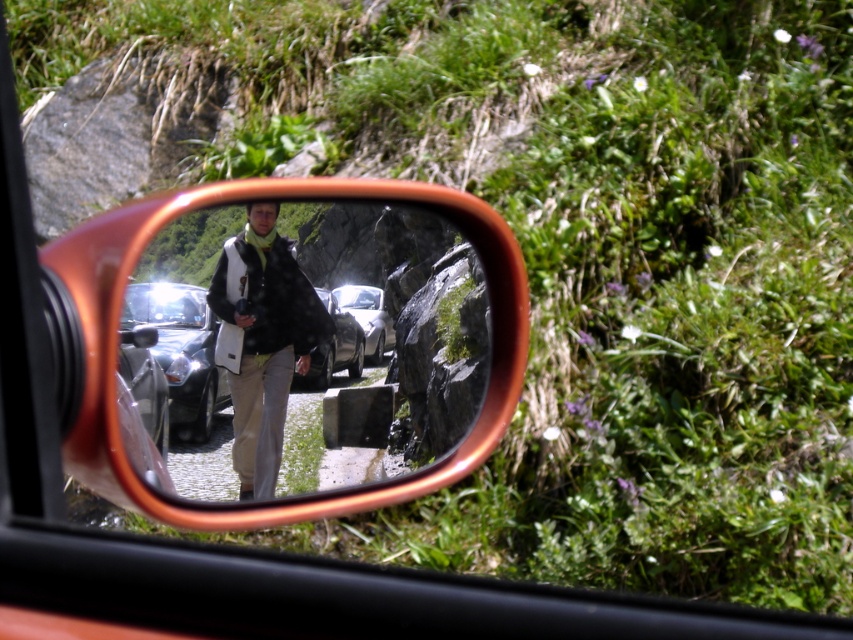
Can you confirm if matte black jacket at center is positioned to the left of shiny silver car at center?

No, matte black jacket at center is not to the left of shiny silver car at center.

Can you confirm if matte black jacket at center is taller than shiny silver car at center?

No.

Between point (254, 250) and point (325, 342), which one is positioned in front?

Point (254, 250)

Identify the location of matte black jacket at center. This screenshot has height=640, width=853. (262, 339).

Is point (207, 419) less distant than point (366, 324)?

That is True.

Does shiny metallic car at center have a larger size compared to metallic silver car at center?

No, shiny metallic car at center is not bigger than metallic silver car at center.

Is point (181, 384) closer to viewer compared to point (374, 312)?

Yes, point (181, 384) is closer to viewer.

The image size is (853, 640). I want to click on shiny metallic car at center, so pos(181,352).

Measure the distance between shiny metallic mirror at center and camera.

The distance of shiny metallic mirror at center from camera is 7.36 feet.

I want to click on shiny metallic mirror at center, so click(x=311, y=340).

Measure the distance between point (x=299, y=314) and camera.

A distance of 6.06 meters exists between point (x=299, y=314) and camera.

Find the location of a particular element. shiny metallic mirror at center is located at coordinates coord(311,340).